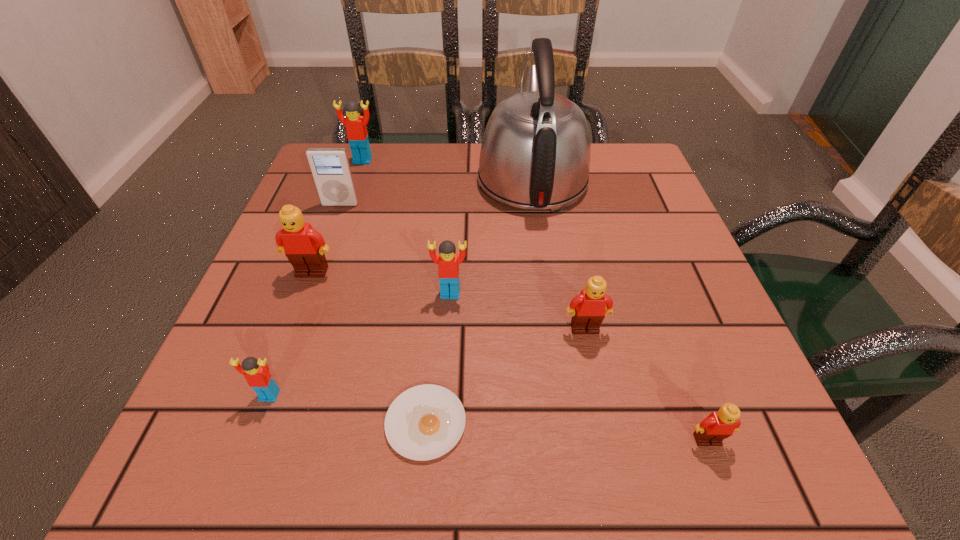
This screenshot has height=540, width=960. I want to click on Lego that is at the right edge, so click(719, 425).

The height and width of the screenshot is (540, 960). In order to click on object situated at the far left corner in this screenshot , I will do `click(357, 135)`.

Find the location of a particular element. This screenshot has height=540, width=960. object that is positioned at the far right corner is located at coordinates (535, 154).

In order to click on object that is at the near right corner in this screenshot , I will do `click(719, 425)`.

Find the location of a particular element. free space at the left edge is located at coordinates (231, 329).

The width and height of the screenshot is (960, 540). In the image, there is a desktop. Identify the location of vacant space at the right edge. (652, 220).

This screenshot has width=960, height=540. In order to click on vacant space at the near left corner of the desktop in this screenshot , I will do `click(292, 436)`.

Find the location of a particular element. This screenshot has height=540, width=960. vacant region at the far right corner is located at coordinates coord(634,161).

At what (x,y) coordinates should I click in order to perform the action: click on vacant space at the near right corner of the desktop. Please return your answer as a coordinate pair (x, y). Looking at the image, I should click on (675, 427).

The width and height of the screenshot is (960, 540). Find the location of `free space between the rightmost Lego and the farthest red Lego`. free space between the rightmost Lego and the farthest red Lego is located at coordinates (535, 300).